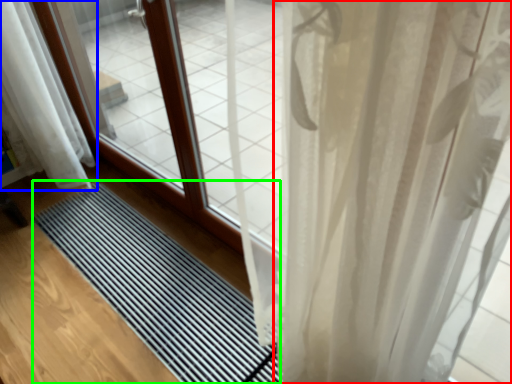
Question: Based on their relative distances, which object is farther from curtain (highlighted by a red box)? Choose from curtain (highlighted by a blue box) and mat (highlighted by a green box).

Choices:
 (A) curtain
 (B) mat

Answer: (A)